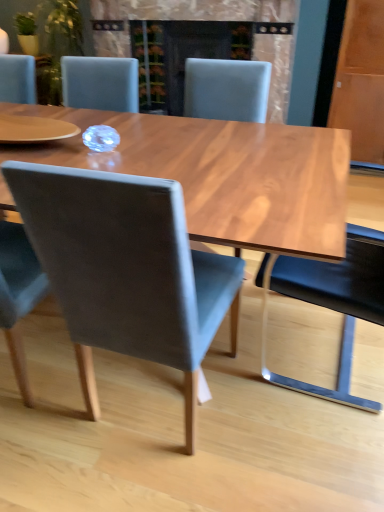
Where is `free space to the right of velvet grey chair at center, the second chair viewed from the left`? The image size is (384, 512). free space to the right of velvet grey chair at center, the second chair viewed from the left is located at coordinates (282, 435).